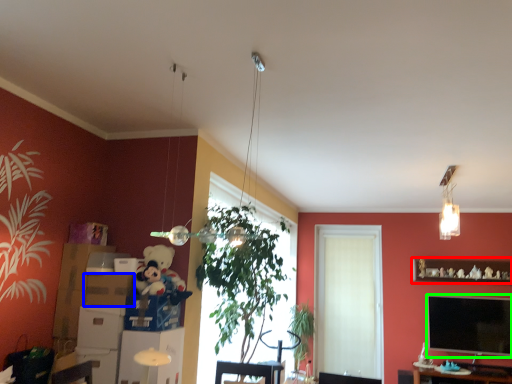
Question: Which object is positioned closest to shelf (highlighted by a red box)? Select from cardboard box (highlighted by a blue box) and television (highlighted by a green box).

Choices:
 (A) cardboard box
 (B) television

Answer: (B)